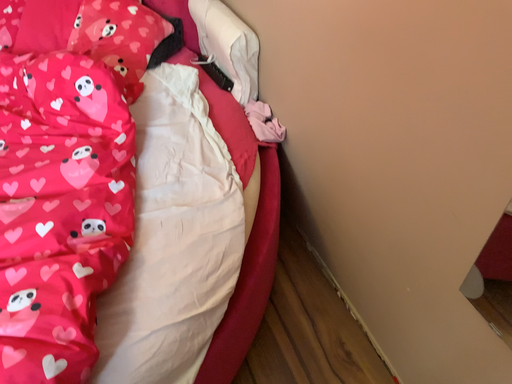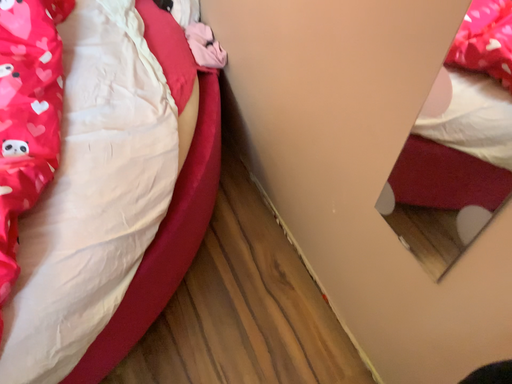
Question: How did the camera likely rotate when shooting the video?

Choices:
 (A) rotated upward
 (B) rotated downward

Answer: (B)